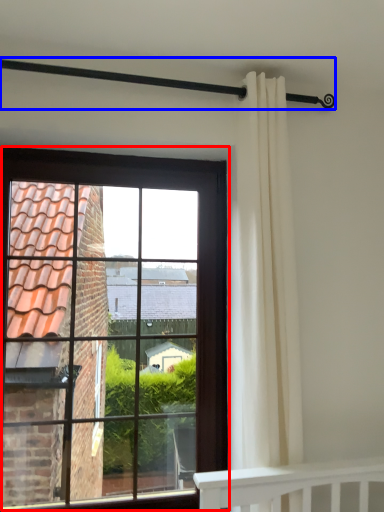
Question: Which object appears closest to the camera in this image, window (highlighted by a red box) or balustrade (highlighted by a blue box)?

Choices:
 (A) window
 (B) balustrade

Answer: (B)